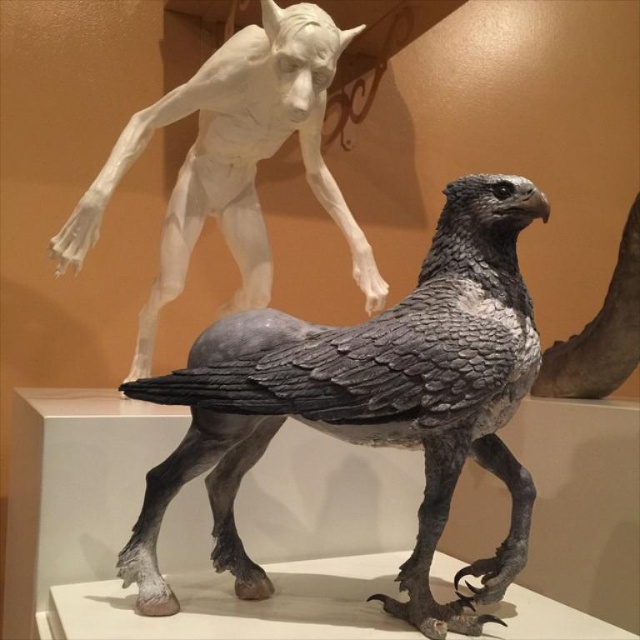
Question: Which object is closer to the camera taking this photo?

Choices:
 (A) gray textured eagle at center
 (B) sculpted stone figure at upper left

Answer: (A)

Question: Is gray textured eagle at center to the right of sculpted stone figure at upper left from the viewer's perspective?

Choices:
 (A) no
 (B) yes

Answer: (B)

Question: Does gray textured eagle at center come behind sculpted stone figure at upper left?

Choices:
 (A) yes
 (B) no

Answer: (B)

Question: Among these points, which one is farthest from the camera?

Choices:
 (A) (232, 241)
 (B) (227, 540)

Answer: (A)

Question: From the image, what is the correct spatial relationship of gray textured eagle at center in relation to sculpted stone figure at upper left?

Choices:
 (A) right
 (B) left

Answer: (A)